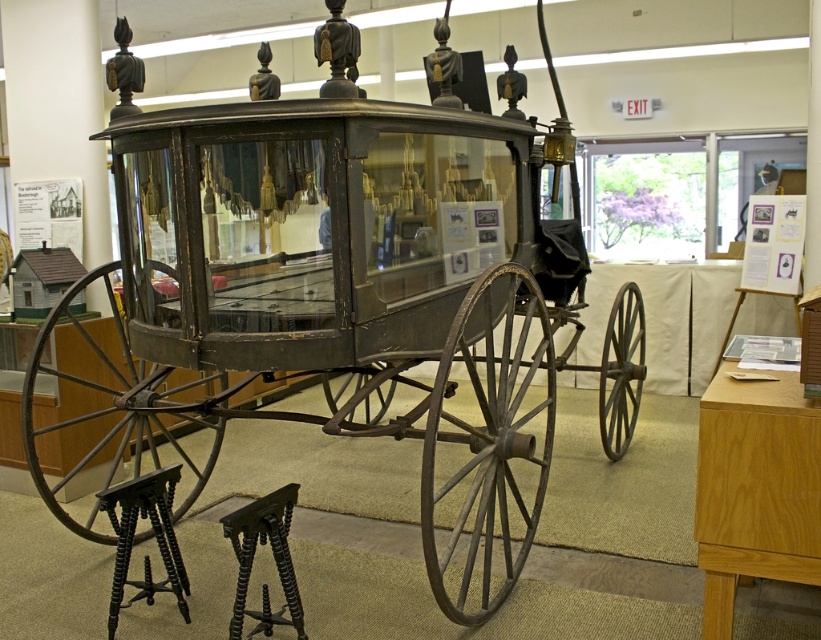
Is black wood stool at lower left in front of black twisted wood stool at lower left?

No, it is not.

Can you confirm if black wood stool at lower left is smaller than black twisted wood stool at lower left?

Actually, black wood stool at lower left might be larger than black twisted wood stool at lower left.

Measure the distance between black wood stool at lower left and camera.

black wood stool at lower left is 2.87 meters away from camera.

Where is `black wood stool at lower left`? black wood stool at lower left is located at coordinates (154, 536).